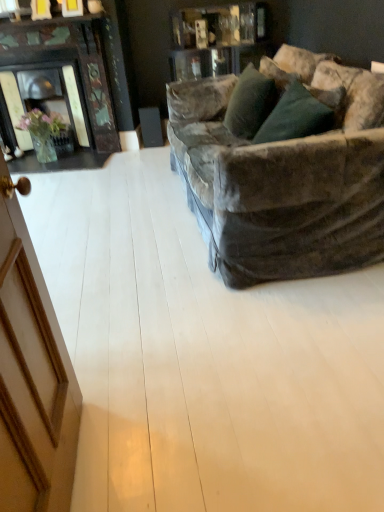
The height and width of the screenshot is (512, 384). In order to click on light wood floor at center in this screenshot , I will do pyautogui.click(x=204, y=357).

The height and width of the screenshot is (512, 384). What do you see at coordinates (204, 357) in the screenshot? I see `light wood floor at center` at bounding box center [204, 357].

Measure the distance between velvet green pillow at upper right and camera.

8.81 feet.

The height and width of the screenshot is (512, 384). What are the coordinates of `velvet green pillow at upper right` in the screenshot? It's located at (250, 103).

The width and height of the screenshot is (384, 512). What do you see at coordinates (250, 103) in the screenshot? I see `velvet green pillow at upper right` at bounding box center [250, 103].

Image resolution: width=384 pixels, height=512 pixels. I want to click on light wood floor at center, so click(204, 357).

Considering the positions of objects velvet green pillow at upper right and light wood floor at center in the image provided, who is more to the left, velvet green pillow at upper right or light wood floor at center?

light wood floor at center is more to the left.

Relative to light wood floor at center, is velvet green pillow at upper right in front or behind?

velvet green pillow at upper right is behind light wood floor at center.

Between point (244, 135) and point (93, 402), which one is positioned in front?

The point (93, 402) is more forward.

From the image's perspective, would you say velvet green pillow at upper right is shown under light wood floor at center?

No, from the image's perspective, velvet green pillow at upper right is not beneath light wood floor at center.

From a real-world perspective, which is physically above, velvet green pillow at upper right or light wood floor at center?

In real-world perspective, velvet green pillow at upper right is above.

Does velvet green pillow at upper right have a greater width compared to light wood floor at center?

No, velvet green pillow at upper right is not wider than light wood floor at center.

Who is taller, velvet green pillow at upper right or light wood floor at center?

With more height is velvet green pillow at upper right.

Consider the image. Who is bigger, velvet green pillow at upper right or light wood floor at center?

With larger size is light wood floor at center.

Which is correct: velvet green pillow at upper right is inside light wood floor at center, or outside of it?

velvet green pillow at upper right is outside light wood floor at center.

Does velvet green pillow at upper right touch light wood floor at center?

velvet green pillow at upper right and light wood floor at center are clearly separated.

Is velvet green pillow at upper right positioned with its back to light wood floor at center?

No, velvet green pillow at upper right is not facing the opposite direction of light wood floor at center.

How many degrees apart are the facing directions of velvet green pillow at upper right and light wood floor at center?

87.4 degrees separate the facing orientations of velvet green pillow at upper right and light wood floor at center.

The height and width of the screenshot is (512, 384). In order to click on pillow above the light wood floor at center (from the image's perspective) in this screenshot , I will do pyautogui.click(x=250, y=103).

Based on their positions, is light wood floor at center located to the left or right of velvet green pillow at upper right?

Based on their positions, light wood floor at center is located to the left of velvet green pillow at upper right.

From the picture: Considering their positions, is light wood floor at center located in front of or behind velvet green pillow at upper right?

In the image, light wood floor at center appears in front of velvet green pillow at upper right.

Considering the positions of point (121, 477) and point (272, 103), is point (121, 477) closer or farther from the camera than point (272, 103)?

Point (121, 477) is positioned closer to the camera compared to point (272, 103).

From the image's perspective, between light wood floor at center and velvet green pillow at upper right, which one is located above?

velvet green pillow at upper right, from the image's perspective.

From a real-world perspective, which is physically above, light wood floor at center or velvet green pillow at upper right?

From a 3D spatial view, velvet green pillow at upper right is above.

Can you confirm if light wood floor at center is thinner than velvet green pillow at upper right?

A: No.

Between light wood floor at center and velvet green pillow at upper right, which one has less height?

Standing shorter between the two is light wood floor at center.

Can you confirm if light wood floor at center is smaller than velvet green pillow at upper right?

No, light wood floor at center is not smaller than velvet green pillow at upper right.

Is light wood floor at center outside of velvet green pillow at upper right?

That's correct, light wood floor at center is outside of velvet green pillow at upper right.

Is light wood floor at center in contact with velvet green pillow at upper right?

No, light wood floor at center is not touching velvet green pillow at upper right.

Is light wood floor at center facing towards velvet green pillow at upper right?

No.

How different are the orientations of light wood floor at center and velvet green pillow at upper right in degrees?

There is a 87.4-degree angle between the facing directions of light wood floor at center and velvet green pillow at upper right.

Locate an element on the screen. The width and height of the screenshot is (384, 512). pillow behind the light wood floor at center is located at coordinates click(x=250, y=103).

Where is `plywood below the velvet green pillow at upper right (from a real-world perspective)`? plywood below the velvet green pillow at upper right (from a real-world perspective) is located at coordinates (204, 357).

The height and width of the screenshot is (512, 384). What are the coordinates of `pillow behind the light wood floor at center` in the screenshot? It's located at (250, 103).